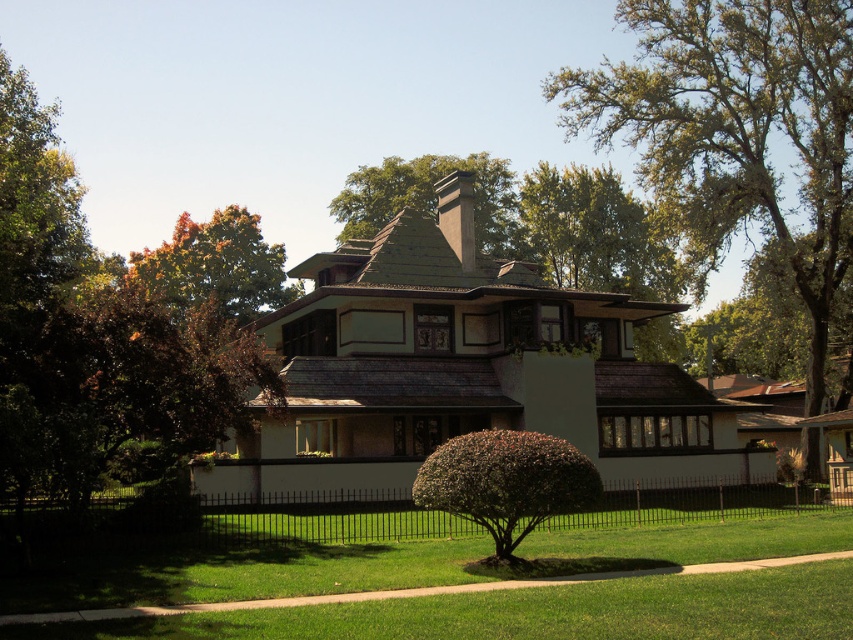
What are the coordinates of the brown leafy tree at upper left in the image?

The brown leafy tree at upper left is located at coordinates point (106, 330).

You are standing in the front yard of the house and want to walk towards the brown textured tree at upper center. Which direction should you walk relative to the brown leafy tree at upper left?

You should walk to the right of the brown leafy tree at upper left since it is positioned to the left of the brown textured tree at upper center.

You are standing in front of the house and want to walk to the black wrought iron fence at center. Which direction should you head relative to the brown leafy tree at upper left?

You should head to the right relative to the brown leafy tree at upper left because the black wrought iron fence at center is located to the right of the brown leafy tree at upper left.